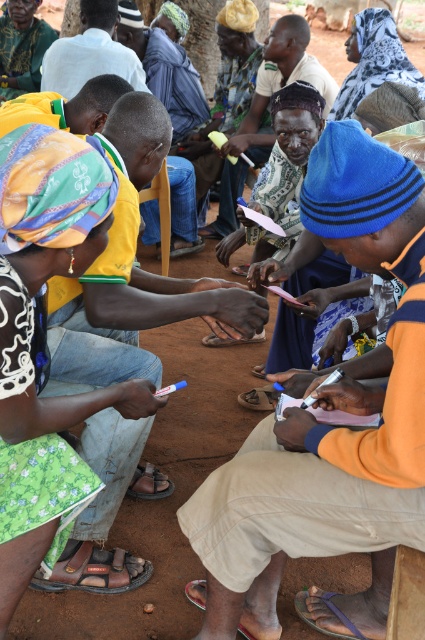
Between white cotton shirt at center and green fabric skirt at lower left, which one appears on the left side from the viewer's perspective?

A: green fabric skirt at lower left is more to the left.

Is point (88, 72) positioned after point (2, 38)?

No, (88, 72) is closer to viewer.

This screenshot has width=425, height=640. I want to click on white cotton shirt at center, so click(x=90, y=52).

Which is above, printed fabric headscarf at left or yellow fabric headscarf at center?

yellow fabric headscarf at center

Measure the distance between point (37, 477) and camera.

A distance of 6.45 feet exists between point (37, 477) and camera.

Where is `printed fabric headscarf at left`? printed fabric headscarf at left is located at coordinates (51, 273).

Does blue striped hat at center appear over white cotton shirt at center?

Actually, blue striped hat at center is below white cotton shirt at center.

Is blue striped hat at center closer to the viewer compared to white cotton shirt at center?

No, it is behind white cotton shirt at center.

Who is more distant from viewer, (260, 160) or (132, 81)?

Point (260, 160)

This screenshot has width=425, height=640. What are the coordinates of `blue striped hat at center` in the screenshot? It's located at (280, 81).